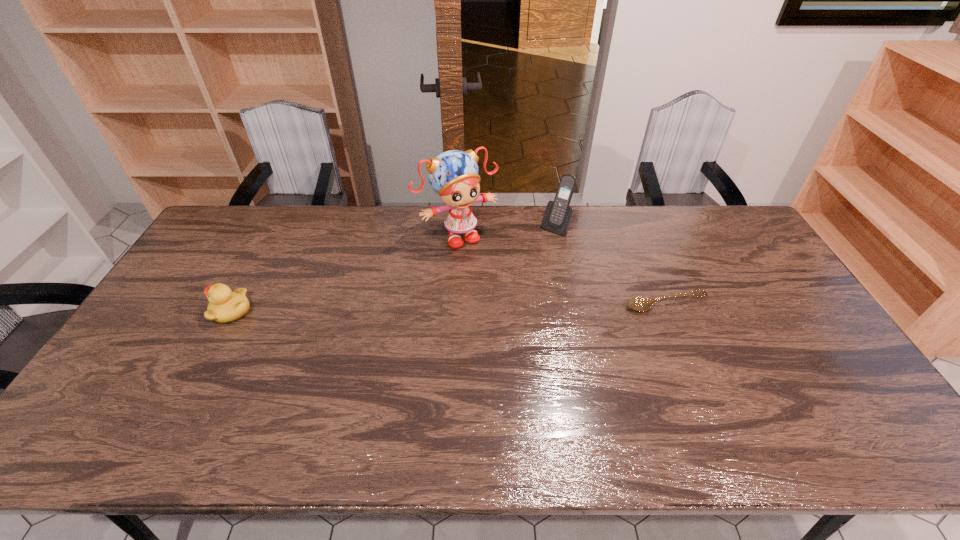
Identify the location of the third tallest object. The image size is (960, 540). (224, 306).

The width and height of the screenshot is (960, 540). What are the coordinates of `the leftmost object` in the screenshot? It's located at (224, 306).

This screenshot has height=540, width=960. Find the location of `ladle`. ladle is located at coordinates (636, 303).

Locate an element on the screen. The width and height of the screenshot is (960, 540). the shortest object is located at coordinates (636, 303).

Where is `the third object from right to left`? This screenshot has height=540, width=960. the third object from right to left is located at coordinates (453, 175).

Identify the location of doll. The height and width of the screenshot is (540, 960). (453, 175).

This screenshot has height=540, width=960. I want to click on the third shortest object, so click(x=558, y=214).

Image resolution: width=960 pixels, height=540 pixels. Identify the location of cellular telephone. (558, 214).

Identify the location of free space located on the front-facing side of the leftmost object. (183, 310).

Identify the location of free space located on the right of the rightmost object. Image resolution: width=960 pixels, height=540 pixels. (764, 304).